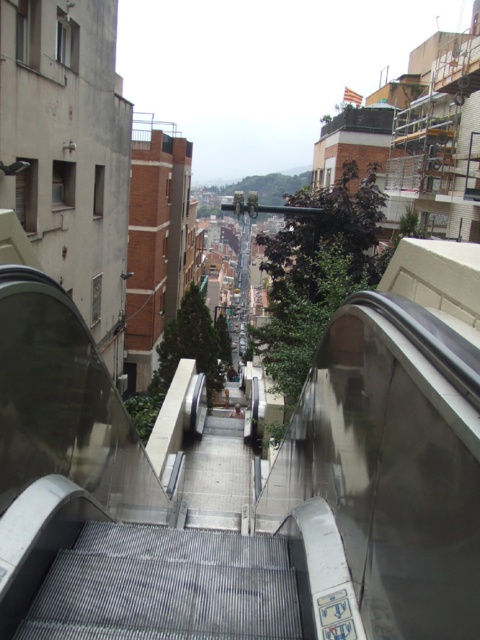
Is metallic gray escalator at center to the left of metallic gray stairs at center from the viewer's perspective?

Incorrect, metallic gray escalator at center is not on the left side of metallic gray stairs at center.

Who is more distant from viewer, (289, 628) or (227, 493)?

Point (227, 493)

Find the location of a particular element. This screenshot has height=640, width=480. metallic gray escalator at center is located at coordinates (167, 586).